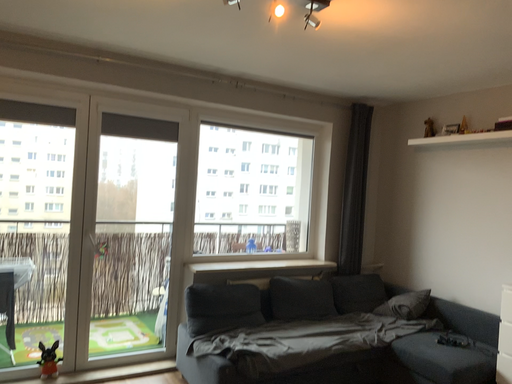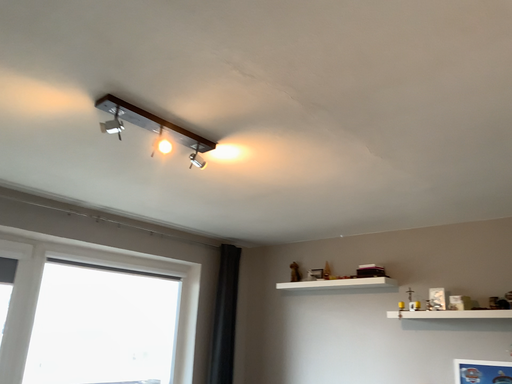
Question: How did the camera likely rotate when shooting the video?

Choices:
 (A) rotated right
 (B) rotated left

Answer: (A)